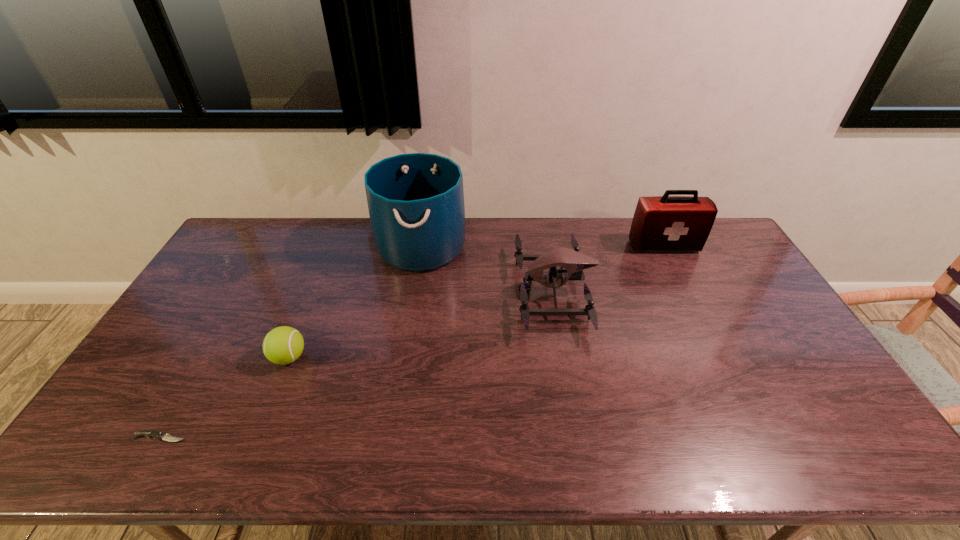
Locate an element on the screen. vacant area situated 0.220m on the left of the bucket is located at coordinates (317, 246).

Identify the location of vacant space situated 0.350m on the side of the fourth shortest object with the cross symbol. (705, 328).

Identify the location of free spot located 0.120m on the front-facing side of the third tallest object. The image size is (960, 540). (479, 292).

Find the location of a particular element. free space located on the front-facing side of the third tallest object is located at coordinates (440, 292).

You are a GUI agent. You are given a task and a screenshot of the screen. Output one action in this format:
    pyautogui.click(x=<x>, y=<y>)
    Task: Click on the free space located 0.130m on the front-facing side of the third tallest object
    The width and height of the screenshot is (960, 540).
    Given the screenshot: What is the action you would take?
    pyautogui.click(x=476, y=292)

You are a GUI agent. You are given a task and a screenshot of the screen. Output one action in this format:
    pyautogui.click(x=<x>, y=<y>)
    Task: Click on the vacant space situated 0.280m on the right of the fourth object from right to left
    
    Given the screenshot: What is the action you would take?
    pyautogui.click(x=406, y=357)

Identify the location of free spot located on the right of the nearest object. (323, 437).

At what (x,y) coordinates should I click in order to perform the action: click on bucket at the far edge. Please return your answer as a coordinate pair (x, y). The image size is (960, 540). Looking at the image, I should click on (416, 201).

Where is `the first aid kit located in the far edge section of the desktop`? The image size is (960, 540). the first aid kit located in the far edge section of the desktop is located at coordinates (665, 223).

Where is `drone present at the far edge`? drone present at the far edge is located at coordinates (573, 262).